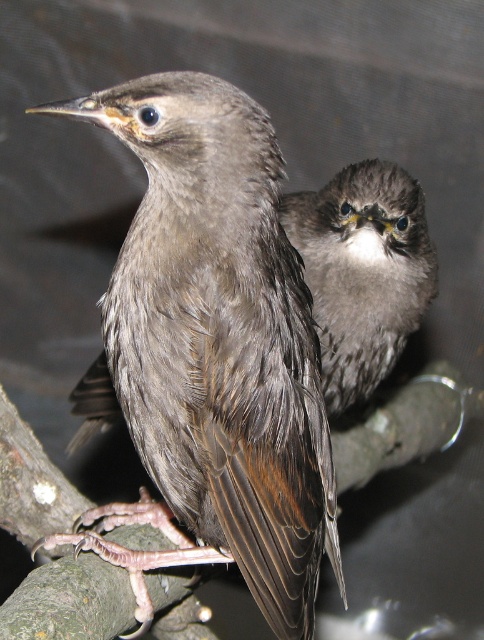
Question: Does brown feathered bird at center have a lesser width compared to fuzzy gray bird at upper right?

Choices:
 (A) yes
 (B) no

Answer: (B)

Question: Can you confirm if brown feathered bird at center is positioned below dark gray feathers at center?

Choices:
 (A) no
 (B) yes

Answer: (B)

Question: Which is nearer to the brown feathered bird at center?

Choices:
 (A) fuzzy gray bird at upper right
 (B) dark gray feathers at center

Answer: (A)

Question: Which of the following is the closest to the observer?

Choices:
 (A) brown feathered bird at center
 (B) dark gray feathers at center

Answer: (A)

Question: Which of these objects is positioned farthest from the fuzzy gray bird at upper right?

Choices:
 (A) dark gray feathers at center
 (B) brown feathered bird at center

Answer: (B)

Question: Can you confirm if dark gray feathers at center is smaller than fuzzy gray bird at upper right?

Choices:
 (A) yes
 (B) no

Answer: (A)